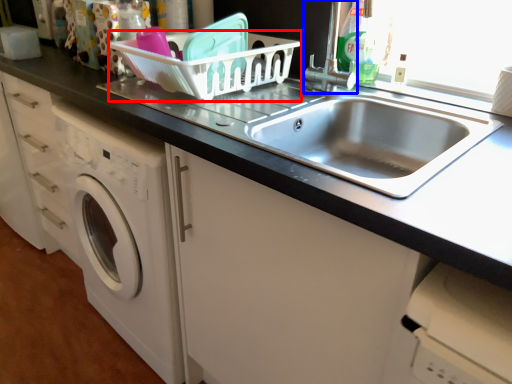
Question: Among these objects, which one is nearest to the camera, basket (highlighted by a red box) or faucet (highlighted by a blue box)?

Choices:
 (A) basket
 (B) faucet

Answer: (A)